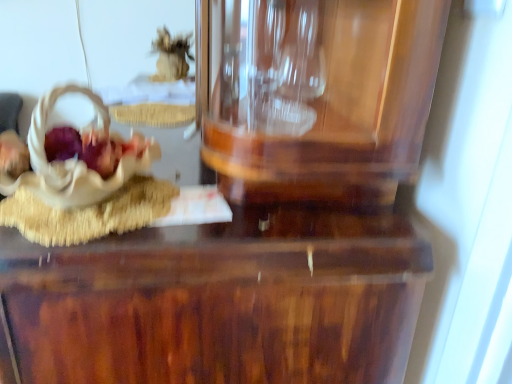
Question: Considering the positions of beige fabric basket at left, the 1th stuff positioned from the front, and glossy wood table at center in the image, is beige fabric basket at left, the 1th stuff positioned from the front, wider or thinner than glossy wood table at center?

Choices:
 (A) wide
 (B) thin

Answer: (B)

Question: Considering the positions of point (50, 107) and point (330, 311), is point (50, 107) closer or farther from the camera than point (330, 311)?

Choices:
 (A) closer
 (B) farther

Answer: (B)

Question: Considering the real-world distances, which object is closest to the beige fabric basket at left, the second stuff positioned from the top?

Choices:
 (A) glossy wood table at center
 (B) matte brown basket at left
 (C) fuzzy brown object at upper center, which is the 1th stuff in top-to-bottom order

Answer: (B)

Question: Estimate the real-world distances between objects in this image. Which object is farther from the matte brown basket at left?

Choices:
 (A) glossy wood table at center
 (B) fuzzy brown object at upper center, which is the 1th stuff in top-to-bottom order
 (C) beige fabric basket at left, the 1th stuff positioned from the front

Answer: (B)